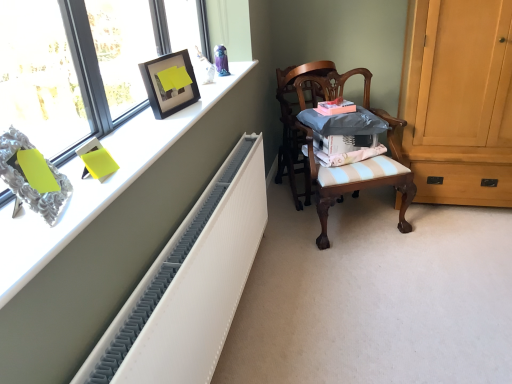
Find the location of `vacant space that is to the left of wooden chair at center, placed as the 2th chair when sorted from back to front`. vacant space that is to the left of wooden chair at center, placed as the 2th chair when sorted from back to front is located at coordinates (286, 228).